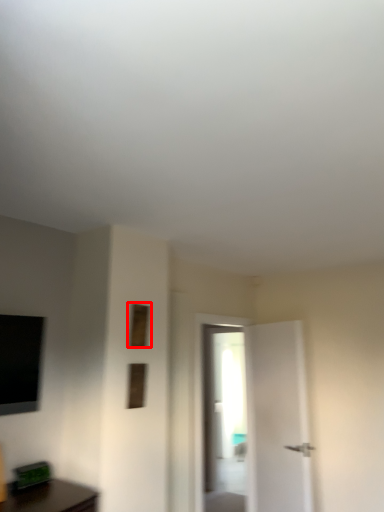
Question: Observing the image, what is the correct spatial positioning of window (annotated by the red box) in reference to window?

Choices:
 (A) right
 (B) left

Answer: (B)